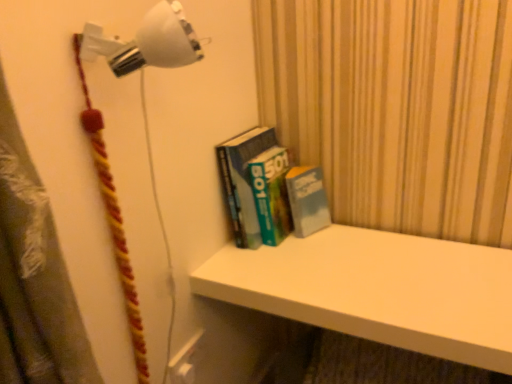
At what (x,y) coordinates should I click in order to perform the action: click on free spot in front of hardcover books at center. Please return your answer as a coordinate pair (x, y). Image resolution: width=512 pixels, height=384 pixels. Looking at the image, I should click on (301, 282).